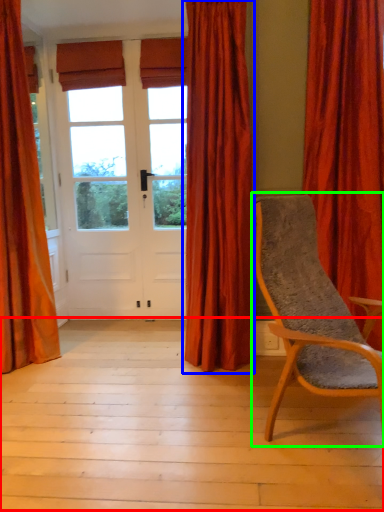
Question: Which object is positioned farthest from porch (highlighted by a red box)? Select from curtain (highlighted by a blue box) and chair (highlighted by a green box).

Choices:
 (A) curtain
 (B) chair

Answer: (A)